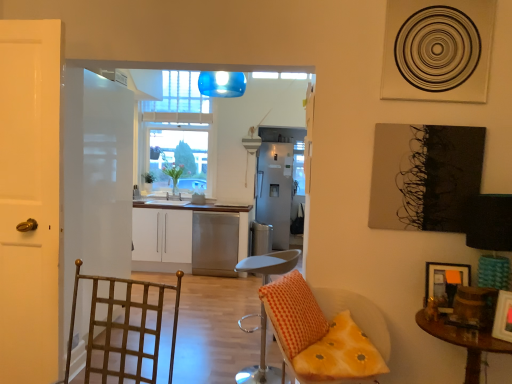
Question: Should I look upward or downward to see wooden picture frame at lower right, which ranks as the second picture frame in front-to-back order?

Choices:
 (A) down
 (B) up

Answer: (A)

Question: Does wooden round table at lower right come in front of orange checkered pillow at center?

Choices:
 (A) yes
 (B) no

Answer: (A)

Question: Is wooden round table at lower right aimed at orange checkered pillow at center?

Choices:
 (A) yes
 (B) no

Answer: (B)

Question: From a real-world perspective, is wooden round table at lower right physically below orange checkered pillow at center?

Choices:
 (A) no
 (B) yes

Answer: (B)

Question: Is wooden round table at lower right turned away from orange checkered pillow at center?

Choices:
 (A) yes
 (B) no

Answer: (B)

Question: Can you confirm if wooden round table at lower right is positioned to the left of orange checkered pillow at center?

Choices:
 (A) no
 (B) yes

Answer: (A)

Question: Can you see wooden round table at lower right touching orange checkered pillow at center?

Choices:
 (A) no
 (B) yes

Answer: (A)

Question: Are wooden picture frame at lower right, positioned as the first picture frame in front-to-back order, and orange checkered pillow at center beside each other?

Choices:
 (A) no
 (B) yes

Answer: (A)

Question: Is wooden picture frame at lower right, positioned as the first picture frame in front-to-back order, completely or partially outside of orange checkered pillow at center?

Choices:
 (A) yes
 (B) no

Answer: (A)

Question: From a real-world perspective, is wooden picture frame at lower right, positioned as the first picture frame in front-to-back order, positioned over orange checkered pillow at center based on gravity?

Choices:
 (A) yes
 (B) no

Answer: (A)

Question: Is wooden picture frame at lower right, which ranks as the 2th picture frame in back-to-front order, to the right of orange checkered pillow at center from the viewer's perspective?

Choices:
 (A) no
 (B) yes

Answer: (B)

Question: Can you confirm if wooden picture frame at lower right, positioned as the first picture frame in front-to-back order, is thinner than orange checkered pillow at center?

Choices:
 (A) yes
 (B) no

Answer: (A)

Question: Is wooden picture frame at lower right, which ranks as the 2th picture frame in back-to-front order, wider than orange checkered pillow at center?

Choices:
 (A) yes
 (B) no

Answer: (B)

Question: Considering the relative sizes of yellow fabric cushion at lower right and white glossy door at left, positioned as the first door in front-to-back order, in the image provided, is yellow fabric cushion at lower right shorter than white glossy door at left, positioned as the first door in front-to-back order,?

Choices:
 (A) yes
 (B) no

Answer: (A)